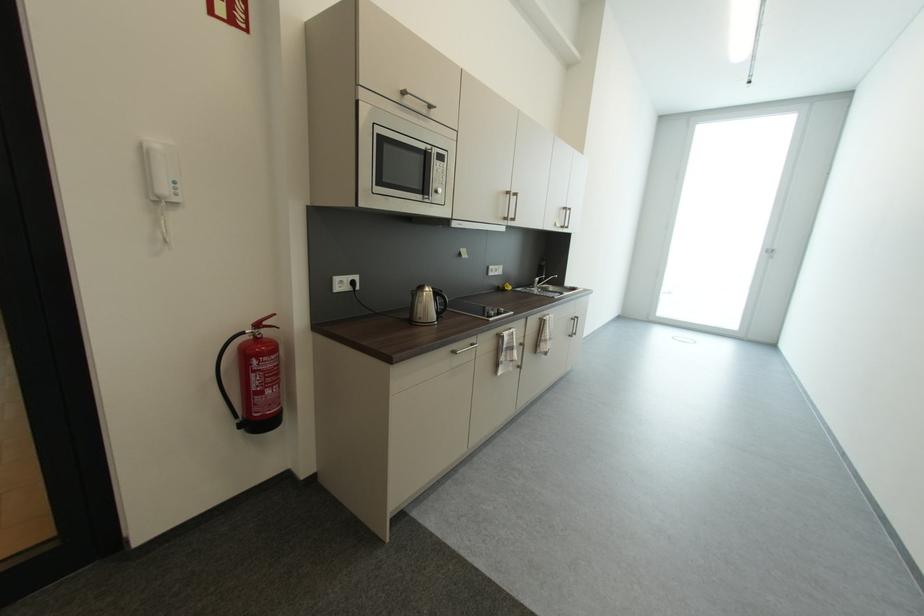
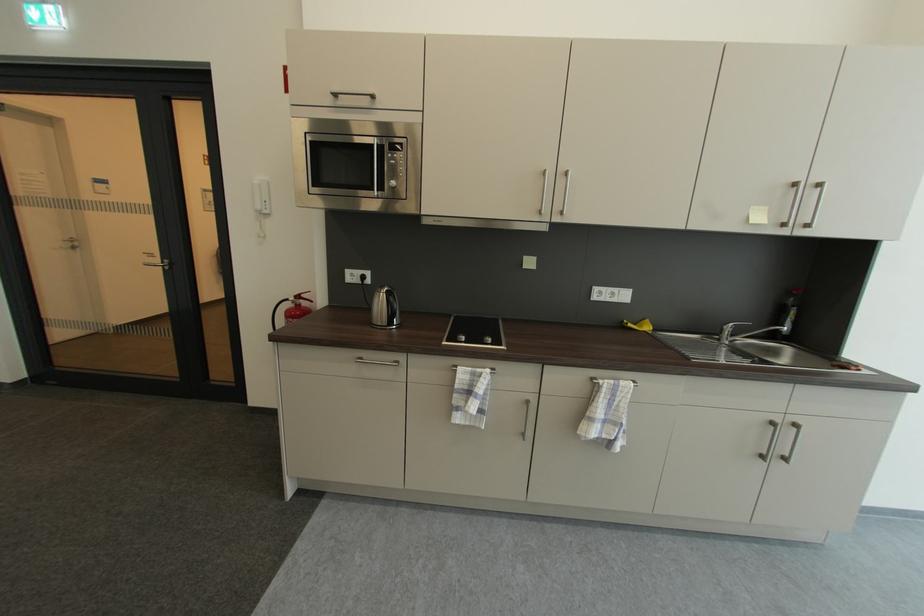
Where in the second image is the point corresponding to the point at 264,326 from the first image?

(305, 299)